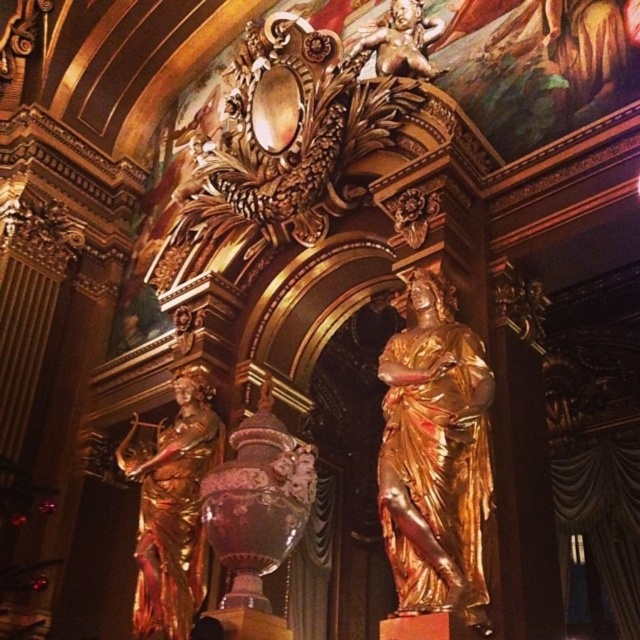
You are an interior designer planning to install a new lighting fixture between the gold polished statue at left and the gold metallic cherub at upper center. The maximum distance the fixture can span is 25 meters. Based on the scene, will the lighting fixture fit between them?

The gold polished statue at left is 27.97 meters from gold metallic cherub at upper center. Since the maximum span of the lighting fixture is 25 meters, it will not fit between them as the distance exceeds the fixture capacity.

You are standing in the grand hall and want to take a photo of both point (376, 468) and point (433, 42). Which point is closer to the camera?

Point (433, 42) is closer to the camera than point (376, 468) because the description states that point (376, 468) is further away.

Looking at this image, you are standing in the grand hall and see the point marked at coordinates [435,458]. Which object is this point located on?

The point marked at coordinates [435,458] is located on the gold polished statue at center.